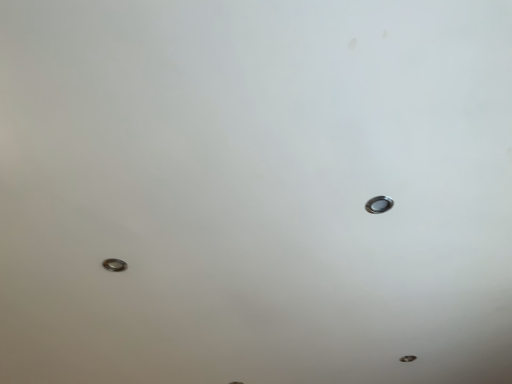
Question: Is silver metallic bolt at lower left positioned with its back to silver metallic nail at upper right?

Choices:
 (A) no
 (B) yes

Answer: (B)

Question: From the image's perspective, does silver metallic bolt at lower left appear higher than silver metallic nail at upper right?

Choices:
 (A) yes
 (B) no

Answer: (B)

Question: From a real-world perspective, is silver metallic bolt at lower left physically above silver metallic nail at upper right?

Choices:
 (A) yes
 (B) no

Answer: (B)

Question: Is silver metallic bolt at lower left to the right of silver metallic nail at upper right from the viewer's perspective?

Choices:
 (A) no
 (B) yes

Answer: (A)

Question: From the image's perspective, is silver metallic bolt at lower left below silver metallic nail at upper right?

Choices:
 (A) no
 (B) yes

Answer: (B)

Question: Is the position of silver metallic bolt at lower left more distant than that of silver metallic nail at upper right?

Choices:
 (A) yes
 (B) no

Answer: (A)

Question: From a real-world perspective, is silver metallic nail at upper right under silver metallic bolt at lower left?

Choices:
 (A) no
 (B) yes

Answer: (A)

Question: Considering the relative sizes of silver metallic nail at upper right and silver metallic bolt at lower left in the image provided, is silver metallic nail at upper right bigger than silver metallic bolt at lower left?

Choices:
 (A) no
 (B) yes

Answer: (A)

Question: Would you say silver metallic bolt at lower left is part of silver metallic nail at upper right's contents?

Choices:
 (A) yes
 (B) no

Answer: (B)

Question: Considering the relative sizes of silver metallic nail at upper right and silver metallic bolt at lower left in the image provided, is silver metallic nail at upper right smaller than silver metallic bolt at lower left?

Choices:
 (A) no
 (B) yes

Answer: (B)

Question: Is silver metallic nail at upper right positioned with its back to silver metallic bolt at lower left?

Choices:
 (A) no
 (B) yes

Answer: (A)

Question: Does silver metallic nail at upper right lie in front of silver metallic bolt at lower left?

Choices:
 (A) yes
 (B) no

Answer: (A)

Question: In terms of size, does silver metallic nail at upper right appear bigger or smaller than silver metallic bolt at lower left?

Choices:
 (A) big
 (B) small

Answer: (B)